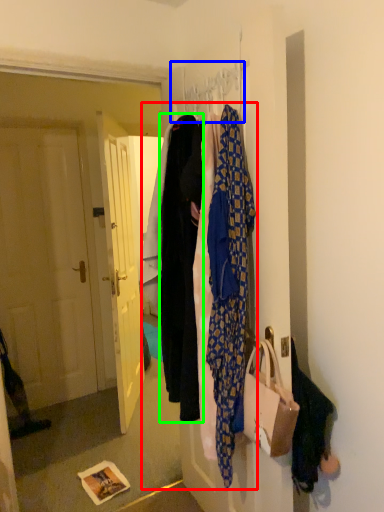
Question: Considering the real-world distances, which object is farthest from closet (highlighted by a red box)? hanger (highlighted by a blue box) or garment (highlighted by a green box)?

Choices:
 (A) hanger
 (B) garment

Answer: (A)